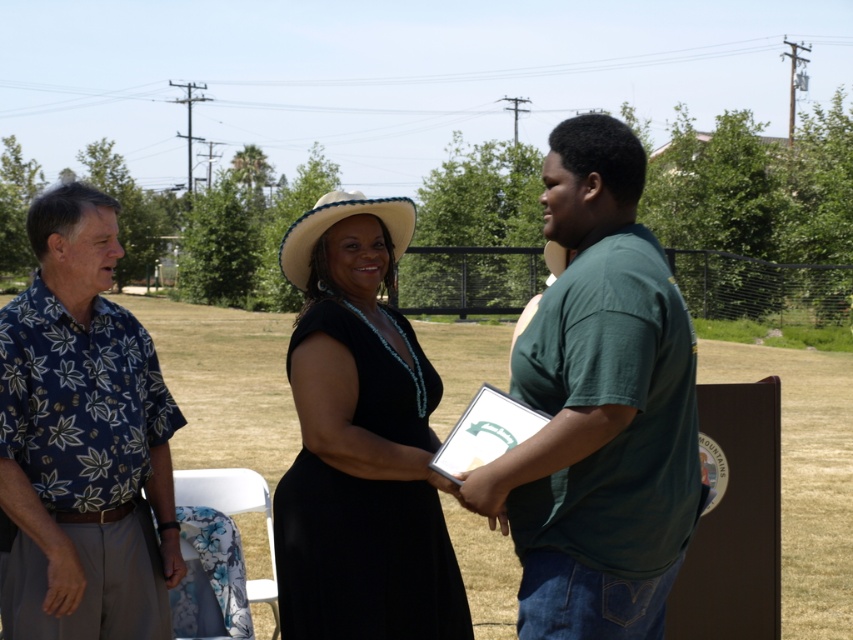
Question: Does green matte shirt at center have a lesser width compared to white straw cowboy hat at center?

Choices:
 (A) yes
 (B) no

Answer: (B)

Question: Which object is closer to the camera taking this photo?

Choices:
 (A) white straw cowboy hat at center
 (B) green matte shirt at center
 (C) black matte dress at center

Answer: (B)

Question: Is green matte shirt at center thinner than black matte dress at center?

Choices:
 (A) no
 (B) yes

Answer: (A)

Question: Which object appears farthest from the camera in this image?

Choices:
 (A) white straw cowboy hat at center
 (B) black matte dress at center
 (C) green matte shirt at center
 (D) blue floral shirt at left

Answer: (D)

Question: Which point is closer to the camera taking this photo?

Choices:
 (A) (386, 442)
 (B) (529, 628)
 (C) (303, 252)
 (D) (1, 337)

Answer: (B)

Question: Is green matte shirt at center below white straw cowboy hat at center?

Choices:
 (A) no
 (B) yes

Answer: (B)